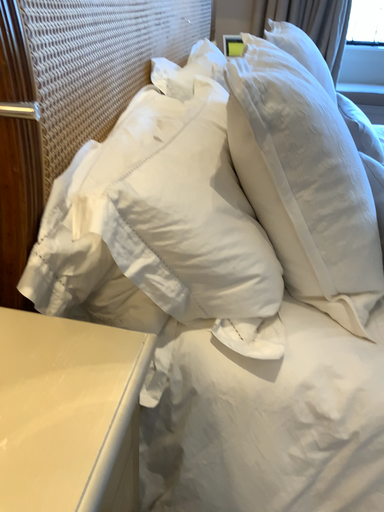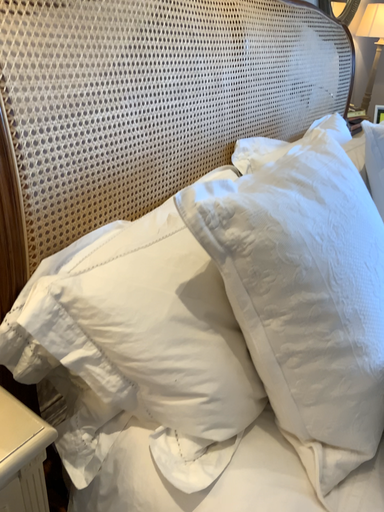
Question: Which way did the camera rotate in the video?

Choices:
 (A) rotated downward
 (B) rotated upward

Answer: (B)